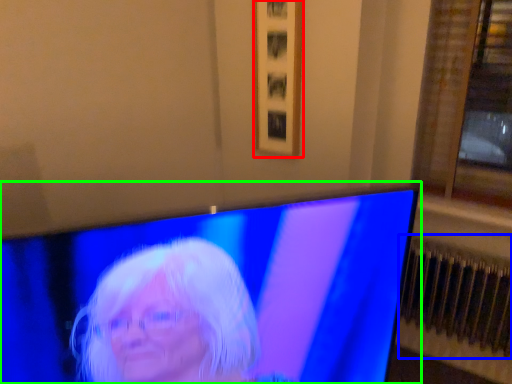
Question: Which is farther away from picture frame (highlighted by a red box)? radiator (highlighted by a blue box) or television (highlighted by a green box)?

Choices:
 (A) radiator
 (B) television

Answer: (B)